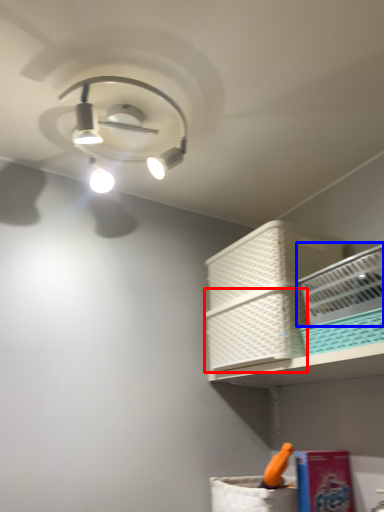
Question: Which object is further to the camera taking this photo, basket (highlighted by a red box) or basket (highlighted by a blue box)?

Choices:
 (A) basket
 (B) basket

Answer: (A)